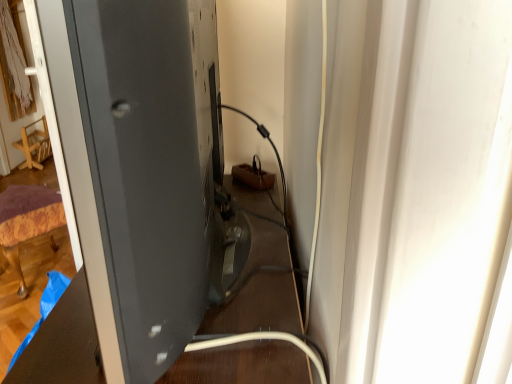
This screenshot has width=512, height=384. What do you see at coordinates (147, 170) in the screenshot?
I see `matte black monitor at left` at bounding box center [147, 170].

Where is `wooden chair at left, which ranks as the second furniture in bottom-to-top order`? The width and height of the screenshot is (512, 384). wooden chair at left, which ranks as the second furniture in bottom-to-top order is located at coordinates (34, 145).

At what (x,y) coordinates should I click in order to perform the action: click on black glossy table at center. Please return your answer as a coordinate pair (x, y). Image resolution: width=512 pixels, height=384 pixels. Looking at the image, I should click on (62, 344).

Is wooden chair at left, the 2th furniture viewed from the front, directly adjacent to matte black monitor at left?

They are not placed beside each other.

Is wooden chair at left, which ranks as the second furniture in bottom-to-top order, at the right side of matte black monitor at left?

Incorrect, wooden chair at left, which ranks as the second furniture in bottom-to-top order, is not on the right side of matte black monitor at left.

From a real-world perspective, is wooden chair at left, the 1th furniture from the left, below matte black monitor at left?

Yes, from a real-world perspective, wooden chair at left, the 1th furniture from the left, is below matte black monitor at left.

Between wooden chair at left, which ranks as the second furniture in bottom-to-top order, and matte black monitor at left, which one has smaller size?

wooden chair at left, which ranks as the second furniture in bottom-to-top order, is smaller.

Is black glossy table at center to the right of matte black monitor at left from the viewer's perspective?

Correct, you'll find black glossy table at center to the right of matte black monitor at left.

Which object is wider, black glossy table at center or matte black monitor at left?

With larger width is black glossy table at center.

Considering the relative positions of black glossy table at center and matte black monitor at left in the image provided, is black glossy table at center behind matte black monitor at left?

That is True.

Is black glossy table at center looking in the opposite direction of matte black monitor at left?

No.

Looking at this image, which of these two, black glossy table at center or wooden chair at left, the 2th furniture viewed from the front, stands taller?

black glossy table at center is taller.

Is black glossy table at center thinner than wooden chair at left, the 1th furniture when ordered from top to bottom?

No.

Is wooden chair at left, which ranks as the second furniture in bottom-to-top order, not within velvet purple ottoman at lower left, which is counted as the second furniture, starting from the left?

Yes, wooden chair at left, which ranks as the second furniture in bottom-to-top order, is outside of velvet purple ottoman at lower left, which is counted as the second furniture, starting from the left.

The height and width of the screenshot is (384, 512). What are the coordinates of `furniture lying on the right of wooden chair at left, the 2th furniture viewed from the front` in the screenshot? It's located at (27, 221).

Who is bigger, wooden chair at left, acting as the first furniture starting from the back, or velvet purple ottoman at lower left, which is counted as the second furniture, starting from the left?

velvet purple ottoman at lower left, which is counted as the second furniture, starting from the left, is bigger.

Considering the positions of objects wooden chair at left, the 2th furniture viewed from the front, and velvet purple ottoman at lower left, which is counted as the second furniture, starting from the left, in the image provided, who is behind, wooden chair at left, the 2th furniture viewed from the front, or velvet purple ottoman at lower left, which is counted as the second furniture, starting from the left,?

wooden chair at left, the 2th furniture viewed from the front, is further from the camera.

Where is `furniture below the matte black monitor at left (from the image's perspective)`? Image resolution: width=512 pixels, height=384 pixels. furniture below the matte black monitor at left (from the image's perspective) is located at coordinates (27, 221).

Is matte black monitor at left inside or outside of velvet purple ottoman at lower left, which ranks as the 2th furniture in top-to-bottom order?

matte black monitor at left lies outside velvet purple ottoman at lower left, which ranks as the 2th furniture in top-to-bottom order.

Consider the image. From the image's perspective, which one is positioned lower, matte black monitor at left or velvet purple ottoman at lower left, which is counted as the second furniture, starting from the left?

velvet purple ottoman at lower left, which is counted as the second furniture, starting from the left, appears lower in the image.

Is velvet purple ottoman at lower left, which is counted as the second furniture, starting from the back, at the back of matte black monitor at left?

No, matte black monitor at left's orientation is not away from velvet purple ottoman at lower left, which is counted as the second furniture, starting from the back.

From a real-world perspective, which is physically above, wooden chair at left, the 2th furniture viewed from the front, or black glossy table at center?

→ In real-world perspective, black glossy table at center is above.

Does wooden chair at left, the second furniture viewed from the right, have a smaller size compared to black glossy table at center?

Correct, wooden chair at left, the second furniture viewed from the right, occupies less space than black glossy table at center.

Is wooden chair at left, the second furniture viewed from the right, located outside black glossy table at center?

Yes, wooden chair at left, the second furniture viewed from the right, is outside of black glossy table at center.

How different are the orientations of wooden chair at left, the second furniture viewed from the right, and black glossy table at center in degrees?

178 degrees.

From the image's perspective, is velvet purple ottoman at lower left, which ranks as the 2th furniture in top-to-bottom order, over matte black monitor at left?

No, from the image's perspective, velvet purple ottoman at lower left, which ranks as the 2th furniture in top-to-bottom order, is not over matte black monitor at left.

Is velvet purple ottoman at lower left, placed as the first furniture when sorted from front to back, aimed at matte black monitor at left?

No, velvet purple ottoman at lower left, placed as the first furniture when sorted from front to back, is not oriented towards matte black monitor at left.

Where is `furniture that is below the matte black monitor at left (from the image's perspective)`? furniture that is below the matte black monitor at left (from the image's perspective) is located at coordinates (27, 221).

From a real-world perspective, relative to matte black monitor at left, is velvet purple ottoman at lower left, which is counted as the second furniture, starting from the back, vertically above or below?

velvet purple ottoman at lower left, which is counted as the second furniture, starting from the back, is below matte black monitor at left.

Find the location of a particular element. The width and height of the screenshot is (512, 384). wide positioned vertically above the wooden chair at left, the 1th furniture when ordered from top to bottom (from a real-world perspective) is located at coordinates (147, 170).

Where is `wide above the black glossy table at center (from the image's perspective)`? The height and width of the screenshot is (384, 512). wide above the black glossy table at center (from the image's perspective) is located at coordinates (147, 170).

Which object lies further to the anchor point wooden chair at left, the 2th furniture viewed from the front, velvet purple ottoman at lower left, placed as the first furniture when sorted from front to back, or matte black monitor at left?

matte black monitor at left is positioned further to the anchor wooden chair at left, the 2th furniture viewed from the front.

Consider the image. Looking at the image, which one is located further to wooden chair at left, the 2th furniture viewed from the front, velvet purple ottoman at lower left, placed as the first furniture when sorted from front to back, or black glossy table at center?

black glossy table at center is further to wooden chair at left, the 2th furniture viewed from the front.

Based on their spatial positions, is matte black monitor at left or black glossy table at center closer to wooden chair at left, the second furniture viewed from the right?

black glossy table at center.

Based on their spatial positions, is black glossy table at center or wooden chair at left, acting as the first furniture starting from the back, further from velvet purple ottoman at lower left, placed as the first furniture when sorted from front to back?

The object further to velvet purple ottoman at lower left, placed as the first furniture when sorted from front to back, is wooden chair at left, acting as the first furniture starting from the back.

Which object lies nearer to the anchor point matte black monitor at left, wooden chair at left, the 1th furniture when ordered from top to bottom, or black glossy table at center?

black glossy table at center is positioned closer to the anchor matte black monitor at left.

Looking at this image, from the image, which object appears to be nearer to matte black monitor at left, black glossy table at center or velvet purple ottoman at lower left, arranged as the 1th furniture when viewed from the right?

Based on the image, black glossy table at center appears to be nearer to matte black monitor at left.

Looking at the image, which one is located further to black glossy table at center, velvet purple ottoman at lower left, placed as the first furniture when sorted from front to back, or matte black monitor at left?

velvet purple ottoman at lower left, placed as the first furniture when sorted from front to back, lies further to black glossy table at center than the other object.

When comparing their distances from velvet purple ottoman at lower left, which ranks as the 2th furniture in top-to-bottom order, does wooden chair at left, the second furniture viewed from the right, or matte black monitor at left seem closer?

matte black monitor at left is positioned closer to the anchor velvet purple ottoman at lower left, which ranks as the 2th furniture in top-to-bottom order.

At what (x,y) coordinates should I click in order to perform the action: click on table between matte black monitor at left and velvet purple ottoman at lower left, which is counted as the second furniture, starting from the left, from front to back. Please return your answer as a coordinate pair (x, y). This screenshot has width=512, height=384. Looking at the image, I should click on (62, 344).

The image size is (512, 384). I want to click on furniture between matte black monitor at left and wooden chair at left, acting as the first furniture starting from the back, from front to back, so click(27, 221).

At what (x,y) coordinates should I click in order to perform the action: click on furniture between black glossy table at center and wooden chair at left, acting as the first furniture starting from the back, in the front-back direction. Please return your answer as a coordinate pair (x, y). Looking at the image, I should click on (27, 221).

Where is `table positioned between matte black monitor at left and wooden chair at left, the 1th furniture from the left, from near to far`? The height and width of the screenshot is (384, 512). table positioned between matte black monitor at left and wooden chair at left, the 1th furniture from the left, from near to far is located at coordinates (62, 344).